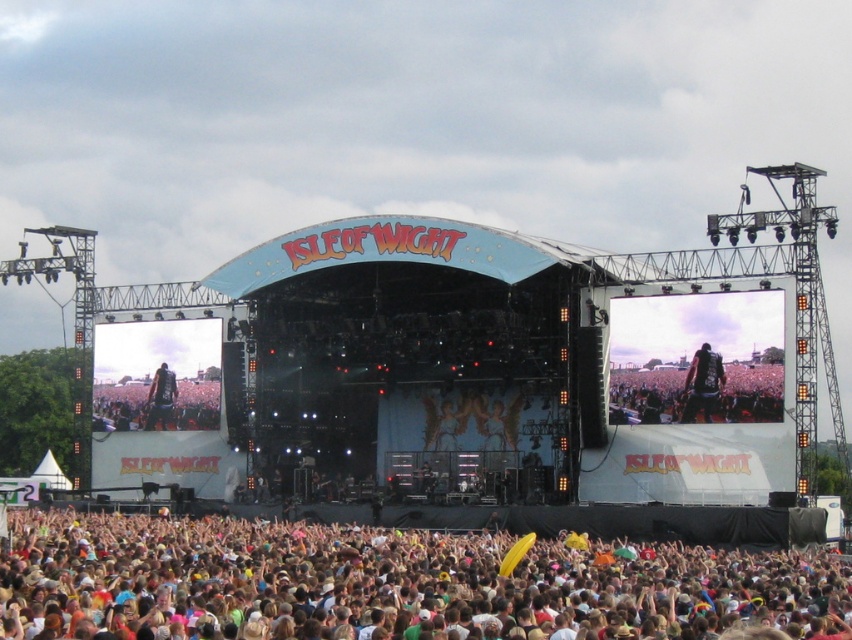
You are a stagehand carrying a 40 meter long banner that needs to be hung between the dark blue fabric at center and the dark brown leather jacket at center. Can the banner reach both objects without needing to be cut?

The distance between the dark blue fabric at center and the dark brown leather jacket at center is 38.20 meters. Since the banner is 40 meters long, it is longer than the required distance, so the banner can reach both objects without needing to be cut.

You are a photographer at the Isle of Wight festival. You need to capture a photo that includes both the multicolored fabric crowd at lower center and the dark blue fabric at center. Which fabric will occupy more space in your photo?

The multicolored fabric crowd at lower center has a larger size compared to dark blue fabric at center, so it will occupy more space in the photo.

You are standing at the edge of the Isle of Wight festival stage and notice the multicolored fabric crowd at lower center and the dark blue leather jacket at center. From your vantage point, which object is positioned to the right?

The multicolored fabric crowd at lower center is to the right of the dark blue leather jacket at center.